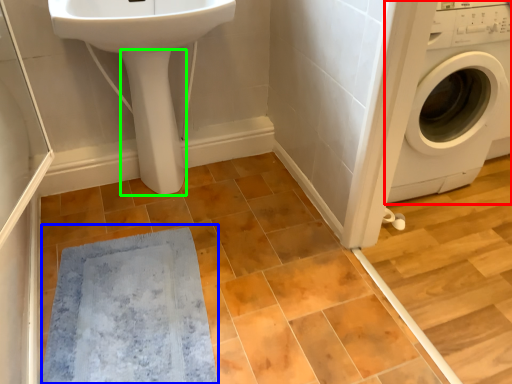
Question: Based on their relative distances, which object is nearer to washing machine (highlighted by a red box)? Choose from bath mat (highlighted by a blue box) and bidet (highlighted by a green box).

Choices:
 (A) bath mat
 (B) bidet

Answer: (B)